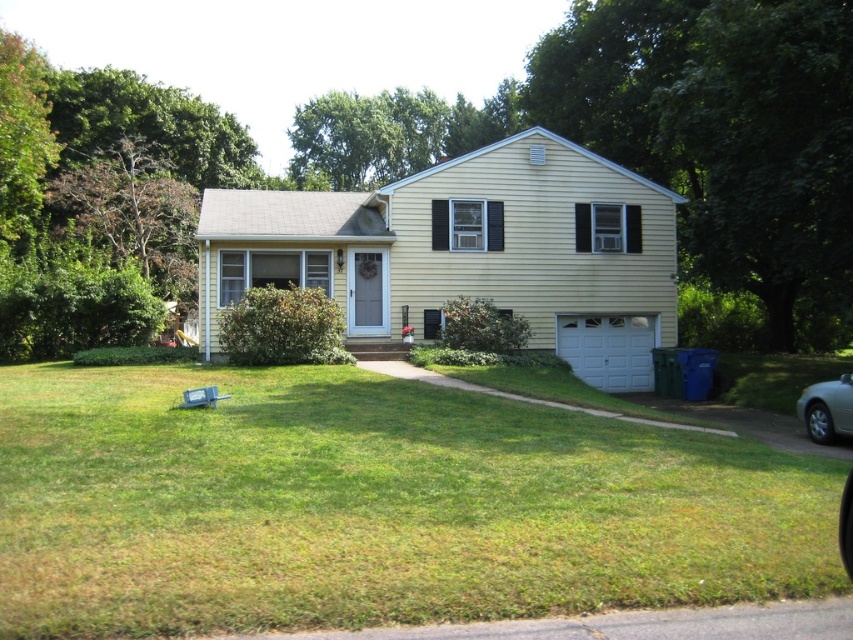
Describe the element at coordinates (373, 506) in the screenshot. I see `green grass at lower center` at that location.

Can you confirm if green grass at lower center is positioned to the right of silver metallic car at lower right?

No, green grass at lower center is not to the right of silver metallic car at lower right.

At what (x,y) coordinates should I click in order to perform the action: click on green grass at lower center. Please return your answer as a coordinate pair (x, y). The width and height of the screenshot is (853, 640). Looking at the image, I should click on (373, 506).